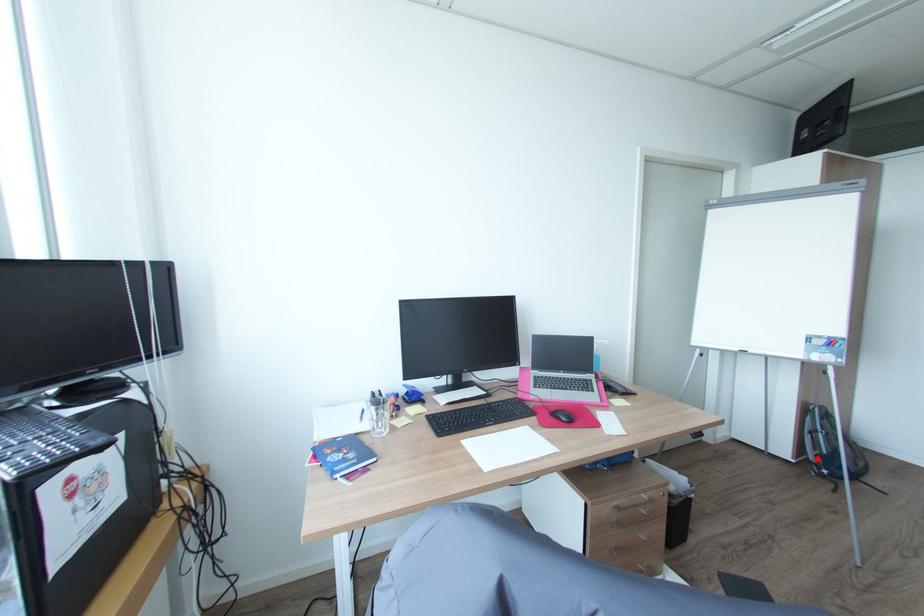
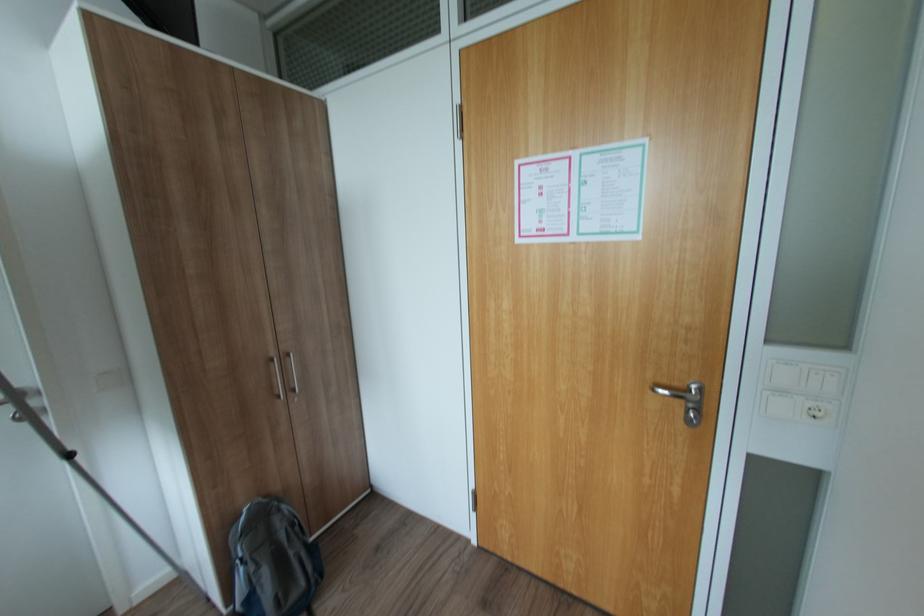
Question: I am providing you with two images of the same scene from different viewpoints. A red point is marked on the first image. Is the red point's position out of view in image 2?

Choices:
 (A) Yes
 (B) No

Answer: (B)